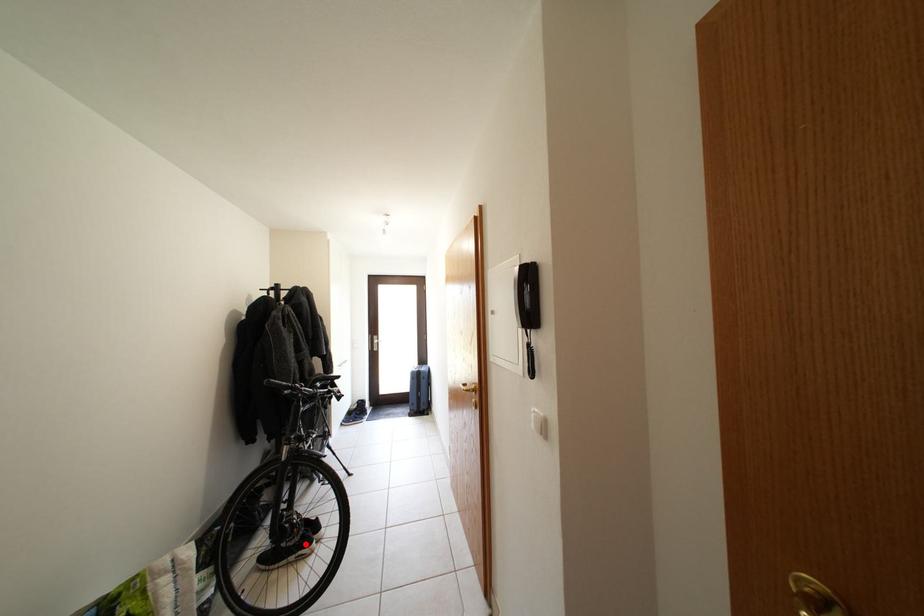
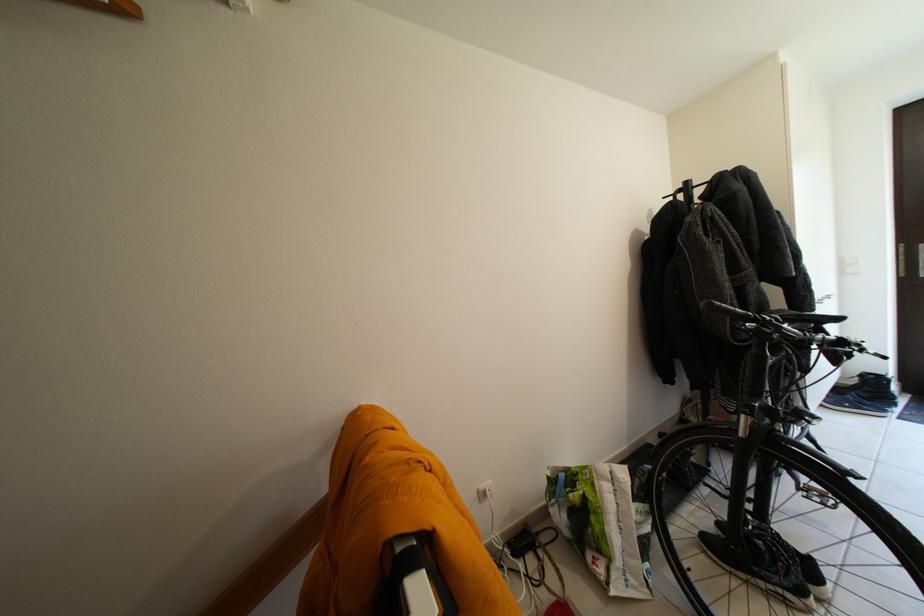
Where in the second image is the point corresponding to the highlighted location from the first image?

(794, 588)